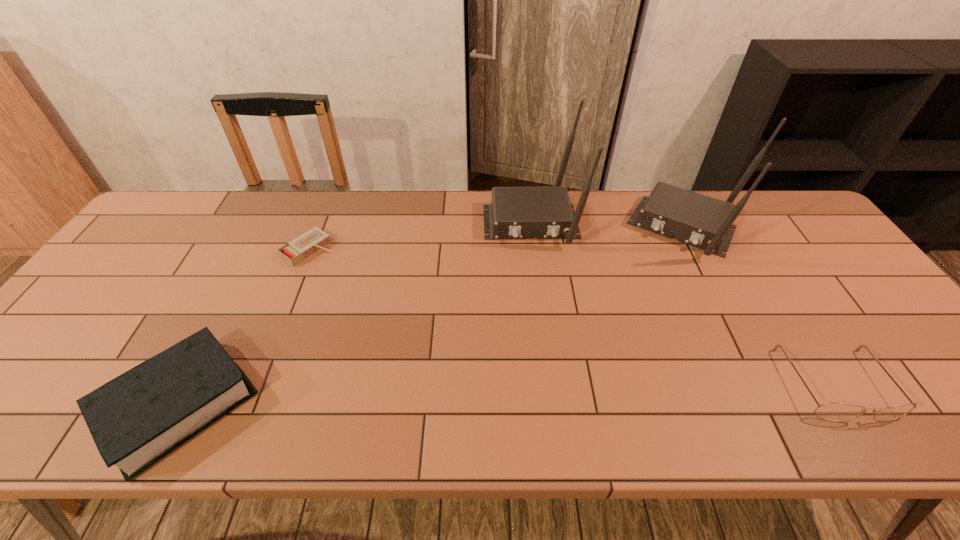
Where is `Bible`? Bible is located at coordinates (136, 419).

At what (x,y) coordinates should I click in order to perform the action: click on the fourth tallest object. Please return your answer as a coordinate pair (x, y). This screenshot has height=540, width=960. Looking at the image, I should click on (831, 411).

I want to click on the third object from right to left, so click(x=515, y=212).

I want to click on the shortest object, so click(x=302, y=247).

Locate an element on the screen. The image size is (960, 540). the right router is located at coordinates (695, 219).

Image resolution: width=960 pixels, height=540 pixels. I want to click on vacant space located on the back of the third tallest object, so click(252, 264).

Identify the location of vacant space located 0.070m on the back of the third object from left to right to connect cables. (538, 269).

At what (x,y) coordinates should I click in order to perform the action: click on vacant space located 0.340m on the back of the third object from left to right to connect cables. Please return your answer as a coordinate pair (x, y). Image resolution: width=960 pixels, height=540 pixels. Looking at the image, I should click on (549, 349).

Locate an element on the screen. This screenshot has width=960, height=540. vacant space located 0.400m on the back of the third object from left to right to connect cables is located at coordinates (552, 372).

Image resolution: width=960 pixels, height=540 pixels. Find the location of `vacant space located on the striking surface of the matchbox`. vacant space located on the striking surface of the matchbox is located at coordinates (362, 285).